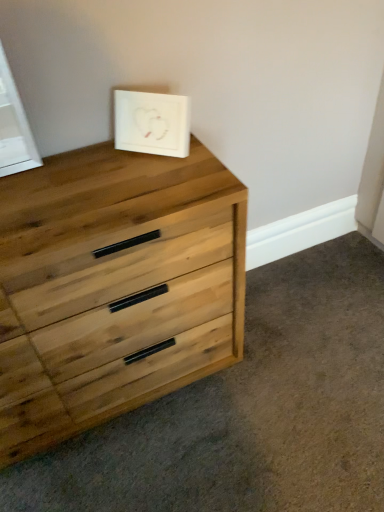
Measure the distance between natural wood chest of drawers at upper left and camera.

natural wood chest of drawers at upper left is 35.35 inches from camera.

The image size is (384, 512). Describe the element at coordinates (114, 287) in the screenshot. I see `natural wood chest of drawers at upper left` at that location.

Locate an element on the screen. The image size is (384, 512). natural wood chest of drawers at upper left is located at coordinates (114, 287).

What is the approximate width of white matte picture frame at upper center?

It is 15.35 centimeters.

In order to face white matte picture frame at upper center, should I rotate leftwards or rightwards?

To face it directly, rotate left by 4.612 degrees.

This screenshot has width=384, height=512. Describe the element at coordinates (151, 123) in the screenshot. I see `white matte picture frame at upper center` at that location.

Image resolution: width=384 pixels, height=512 pixels. What are the coordinates of `white matte picture frame at upper center` in the screenshot? It's located at (151, 123).

Measure the distance between point (129,106) and camera.

A distance of 1.12 meters exists between point (129,106) and camera.

Image resolution: width=384 pixels, height=512 pixels. Find the location of `natural wood chest of drawers at upper left`. natural wood chest of drawers at upper left is located at coordinates (114, 287).

Which object is positioned more to the left, white matte picture frame at upper center or natural wood chest of drawers at upper left?

natural wood chest of drawers at upper left is more to the left.

In the image, is white matte picture frame at upper center positioned in front of or behind natural wood chest of drawers at upper left?

Clearly, white matte picture frame at upper center is behind natural wood chest of drawers at upper left.

Does point (158, 100) come behind point (1, 377)?

No, (158, 100) is closer to viewer.

From the image's perspective, is white matte picture frame at upper center above or below natural wood chest of drawers at upper left?

white matte picture frame at upper center is situated higher than natural wood chest of drawers at upper left in the image.

From a real-world perspective, is white matte picture frame at upper center over natural wood chest of drawers at upper left?

Yes.

Considering the relative sizes of white matte picture frame at upper center and natural wood chest of drawers at upper left in the image provided, is white matte picture frame at upper center wider than natural wood chest of drawers at upper left?

Incorrect, the width of white matte picture frame at upper center does not surpass that of natural wood chest of drawers at upper left.

Is white matte picture frame at upper center shorter than natural wood chest of drawers at upper left?

Indeed, white matte picture frame at upper center has a lesser height compared to natural wood chest of drawers at upper left.

Between white matte picture frame at upper center and natural wood chest of drawers at upper left, which one has smaller size?

With smaller size is white matte picture frame at upper center.

Do you think white matte picture frame at upper center is within natural wood chest of drawers at upper left, or outside of it?

white matte picture frame at upper center exists outside the volume of natural wood chest of drawers at upper left.

Is white matte picture frame at upper center next to natural wood chest of drawers at upper left and touching it?

No, white matte picture frame at upper center is not in contact with natural wood chest of drawers at upper left.

Is white matte picture frame at upper center positioned with its back to natural wood chest of drawers at upper left?

white matte picture frame at upper center does not have its back to natural wood chest of drawers at upper left.

There is a natural wood chest of drawers at upper left. Where is `picture frame above it (from a real-world perspective)`? This screenshot has height=512, width=384. picture frame above it (from a real-world perspective) is located at coordinates (151, 123).

Between natural wood chest of drawers at upper left and white matte picture frame at upper center, which one appears on the left side from the viewer's perspective?

From the viewer's perspective, natural wood chest of drawers at upper left appears more on the left side.

Is natural wood chest of drawers at upper left closer to the viewer compared to white matte picture frame at upper center?

Yes, it is.

Which is farther, (241,278) or (152,148)?

The point (241,278) is more distant.

From the image's perspective, is natural wood chest of drawers at upper left over white matte picture frame at upper center?

No.

From a real-world perspective, is natural wood chest of drawers at upper left on top of white matte picture frame at upper center?

Actually, natural wood chest of drawers at upper left is physically below white matte picture frame at upper center in the real world.

Considering the relative sizes of natural wood chest of drawers at upper left and white matte picture frame at upper center in the image provided, is natural wood chest of drawers at upper left wider than white matte picture frame at upper center?

Correct, the width of natural wood chest of drawers at upper left exceeds that of white matte picture frame at upper center.

Considering the sizes of objects natural wood chest of drawers at upper left and white matte picture frame at upper center in the image provided, who is shorter, natural wood chest of drawers at upper left or white matte picture frame at upper center?

white matte picture frame at upper center.

Can you confirm if natural wood chest of drawers at upper left is bigger than white matte picture frame at upper center?

Indeed, natural wood chest of drawers at upper left has a larger size compared to white matte picture frame at upper center.

Consider the image. Is natural wood chest of drawers at upper left inside the boundaries of white matte picture frame at upper center, or outside?

natural wood chest of drawers at upper left is not inside white matte picture frame at upper center, it's outside.

Would you say natural wood chest of drawers at upper left is a long distance from white matte picture frame at upper center?

That's not correct — natural wood chest of drawers at upper left is a little close to white matte picture frame at upper center.

Is natural wood chest of drawers at upper left oriented towards white matte picture frame at upper center?

No, natural wood chest of drawers at upper left is not facing towards white matte picture frame at upper center.

How many degrees apart are the facing directions of natural wood chest of drawers at upper left and white matte picture frame at upper center?

44.2 degrees separate the facing orientations of natural wood chest of drawers at upper left and white matte picture frame at upper center.

Measure the distance between natural wood chest of drawers at upper left and white matte picture frame at upper center.

They are 14.90 inches apart.

Locate an element on the screen. This screenshot has height=512, width=384. chest of drawers below the white matte picture frame at upper center (from the image's perspective) is located at coordinates pyautogui.click(x=114, y=287).

Identify the location of chest of drawers on the left side of white matte picture frame at upper center. (114, 287).

Find the location of a particular element. The width and height of the screenshot is (384, 512). picture frame that appears above the natural wood chest of drawers at upper left (from the image's perspective) is located at coordinates (151, 123).